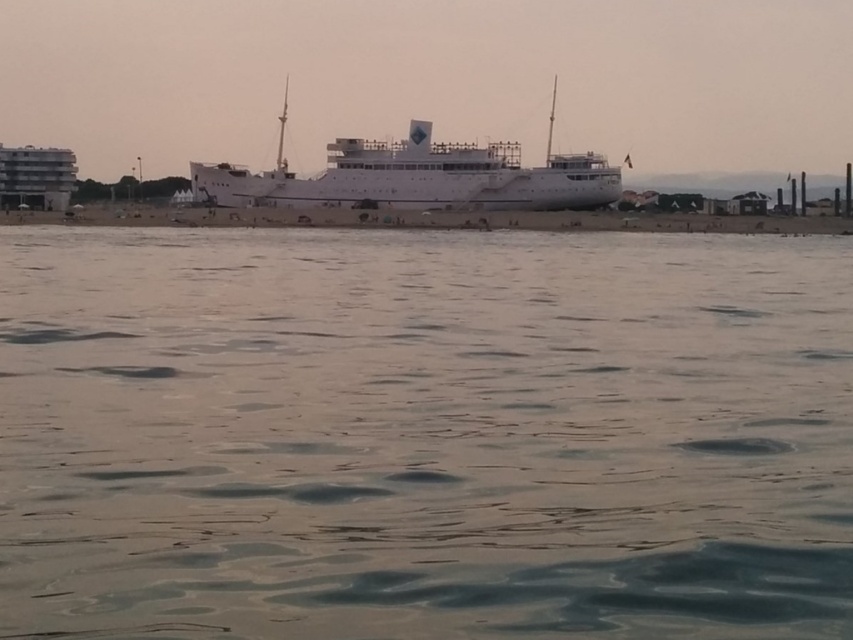
Between point (432, 470) and point (532, 209), which one is positioned behind?

Point (532, 209)

Which of these two, clear water at center or white glossy ship at center, stands taller?

white glossy ship at center is taller.

What do you see at coordinates (422, 433) in the screenshot? I see `clear water at center` at bounding box center [422, 433].

What are the coordinates of `clear water at center` in the screenshot? It's located at (422, 433).